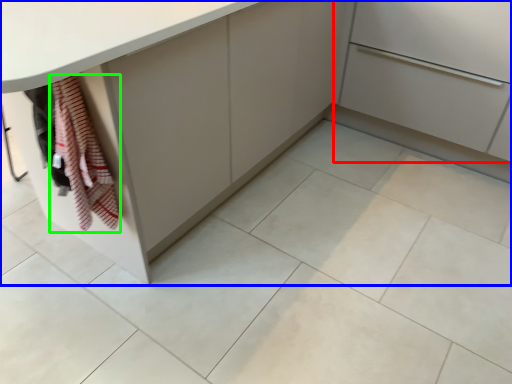
Question: Which object is the farthest from cabinetry (highlighted by a red box)? Choose among these: cabinetry (highlighted by a blue box) or blanket (highlighted by a green box).

Choices:
 (A) cabinetry
 (B) blanket

Answer: (B)